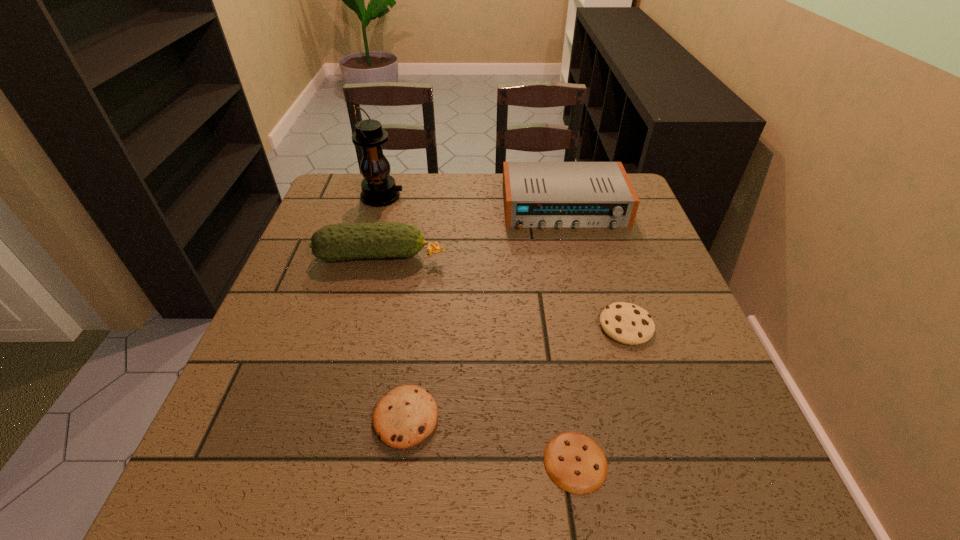
Image resolution: width=960 pixels, height=540 pixels. Identify the location of vacant space that satisfies the following two spatial constraints: 1. at the blossom end of the cucumber; 2. on the back side of the third nearest object. (363, 326).

You are a GUI agent. You are given a task and a screenshot of the screen. Output one action in this format:
    pyautogui.click(x=<x>, y=<y>)
    Task: Click on the free space that satisfies the following two spatial constraints: 1. on the back side of the shortest cookie; 2. above the tallest object, indicating its light source
    
    Given the screenshot: What is the action you would take?
    pyautogui.click(x=533, y=197)